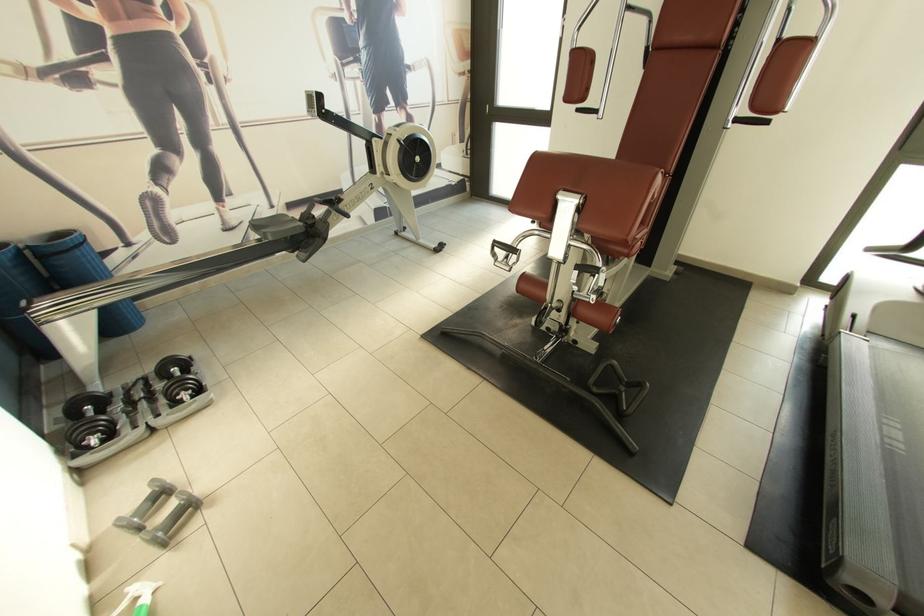
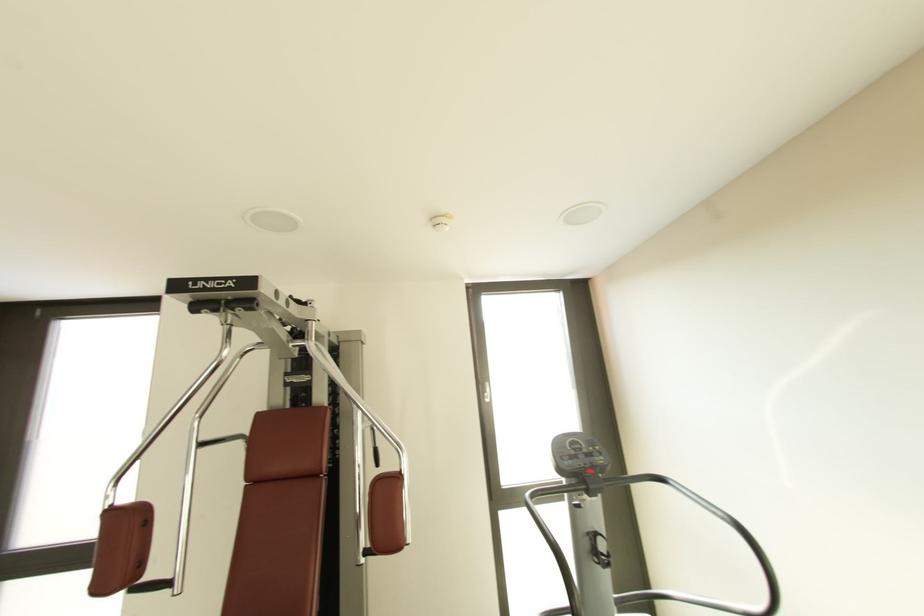
Looking at this image, the images are taken continuously from a first-person perspective. In which direction is your viewpoint rotating?

The camera's rotation is toward right-up.